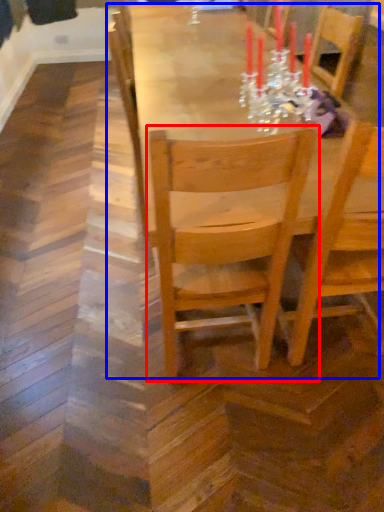
Question: Among these objects, which one is nearest to the camera, chair (highlighted by a red box) or table (highlighted by a blue box)?

Choices:
 (A) chair
 (B) table

Answer: (A)